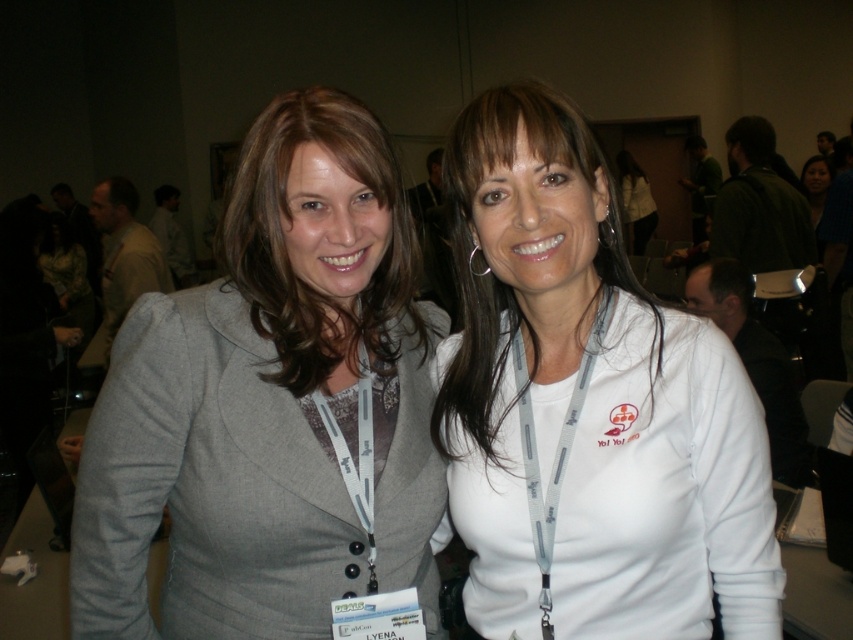
You are trying to determine which piece of clothing is smaller between the gray fabric jacket at center and the white matte shirt at center. Based on the scene, which one is smaller?

The gray fabric jacket at center is smaller compared to the white matte shirt at center.